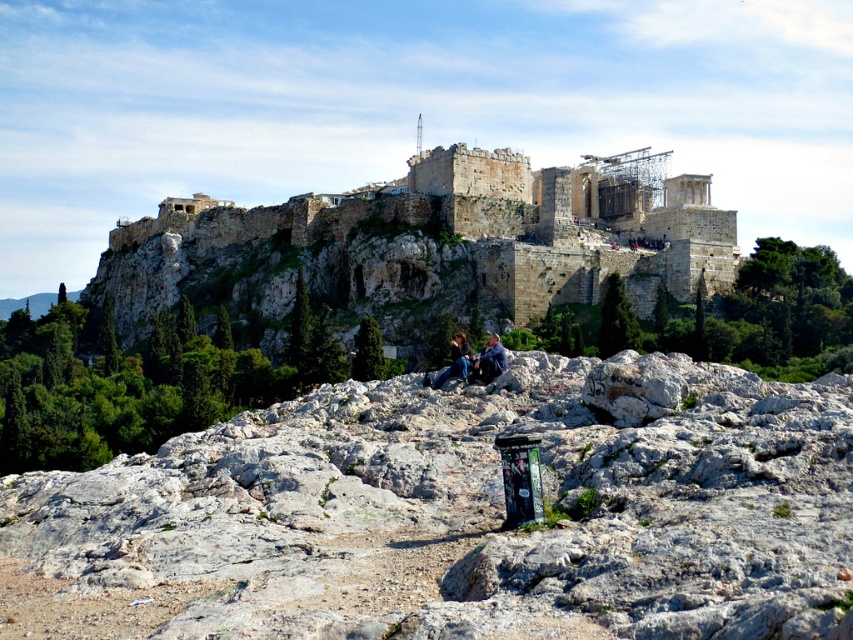
You are a tourist standing at the base of the Acropolis. You see the white rock at center and the blue denim jeans at center. Which object is closer to you?

The white rock at center is closer to you because it is in front of the blue denim jeans at center.